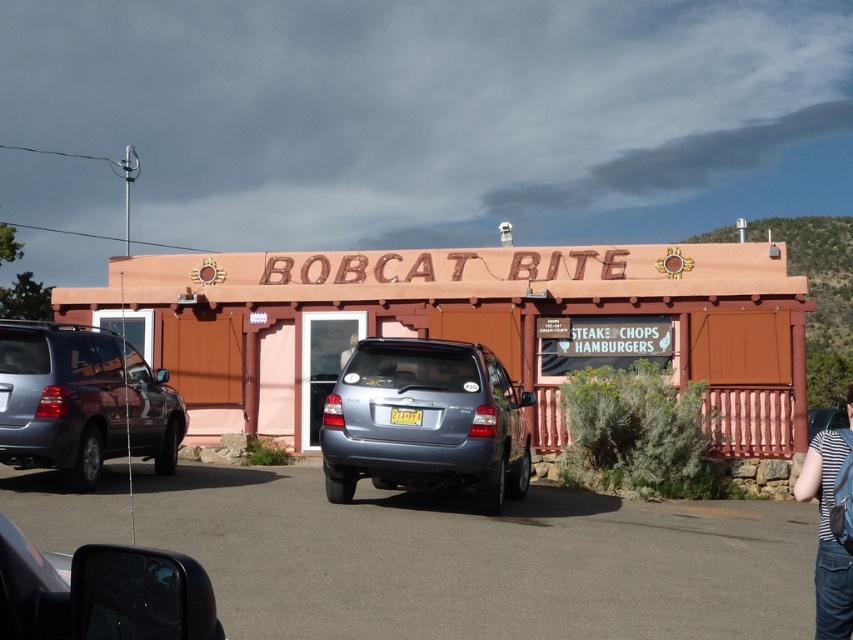
You are a delivery person arriving at Bobcat Bite restaurant. You need to park your metallic silver suv at center in the gray asphalt parking lot at center. Can you safely park your vehicle there?

The gray asphalt parking lot at center is located above the metallic silver suv at center, which means the suv is already parked there. Therefore, you can safely park your vehicle there.

You are a delivery driver arriving at the Bobcat Bite restaurant. You need to park your matte gray suv at left in the gray asphalt parking lot at center. Can you fit your vehicle into the parking lot space based on their sizes?

The gray asphalt parking lot at center is not as tall as matte gray suv at left, so the parking lot space is shorter in height than the SUV. Therefore, the matte gray suv at left may not fit into the gray asphalt parking lot at center due to insufficient vertical clearance.

You are driving a car and want to park in front of the Bobcat Bite restaurant. The parking lot has a designated parking spot for vehicles with a length of 4.5 meters. The satin blue suv at center is currently parked at point 0.659, 0.499. Can you determine if your car can fit in the parking spot?

The satin blue suv at center is parked at point (425, 420), but the provided information does not include the length of the satin blue suv at center. Therefore, it is impossible to determine if your car can fit in the parking spot.